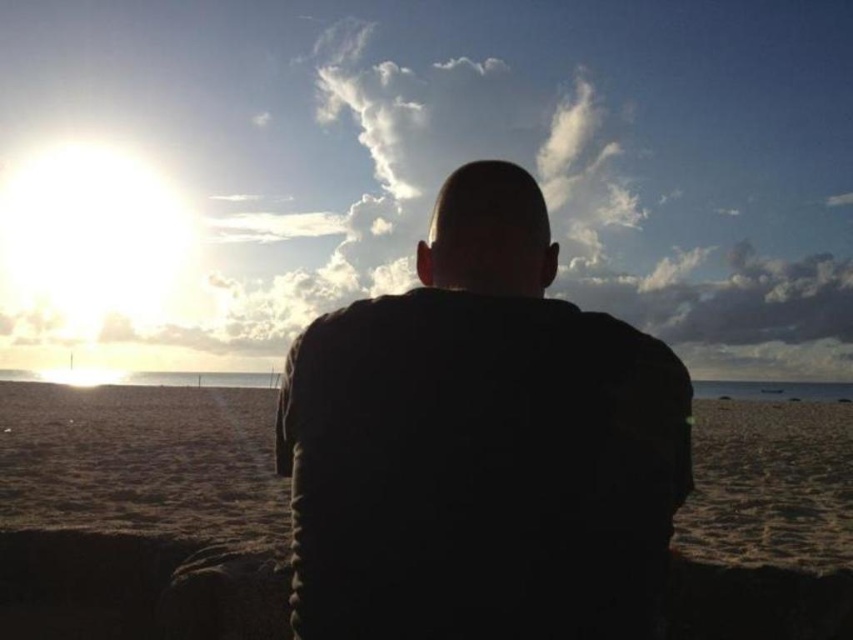
Question: Is black matte jacket at center closer to the viewer compared to sandy beach at center?

Choices:
 (A) no
 (B) yes

Answer: (B)

Question: Which of the following is the closest to the observer?

Choices:
 (A) (210, 452)
 (B) (473, 604)

Answer: (B)

Question: Which point is farther to the camera?

Choices:
 (A) sandy beach at center
 (B) black matte jacket at center

Answer: (A)

Question: Is black matte jacket at center behind sandy beach at center?

Choices:
 (A) yes
 (B) no

Answer: (B)

Question: Can you confirm if black matte jacket at center is positioned below sandy beach at center?

Choices:
 (A) yes
 (B) no

Answer: (B)